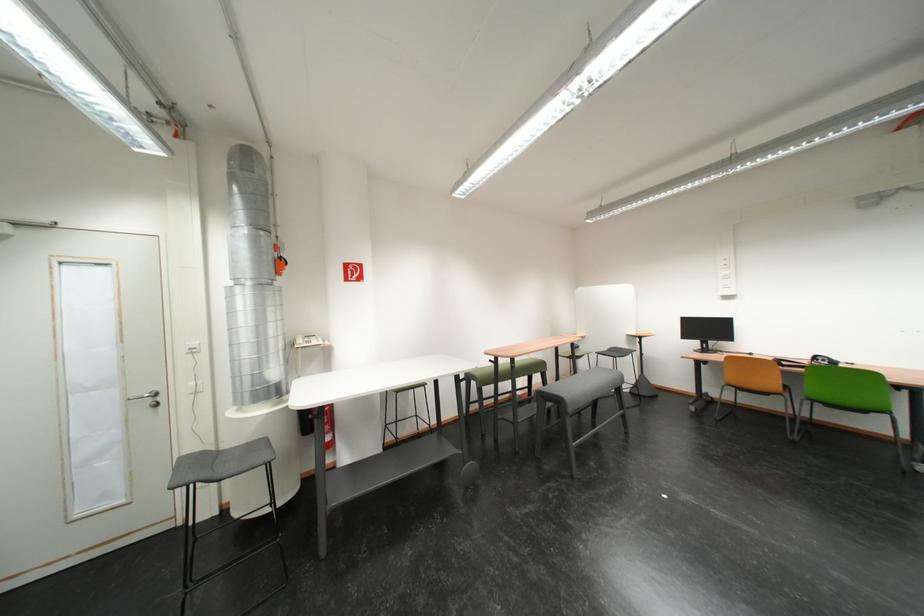
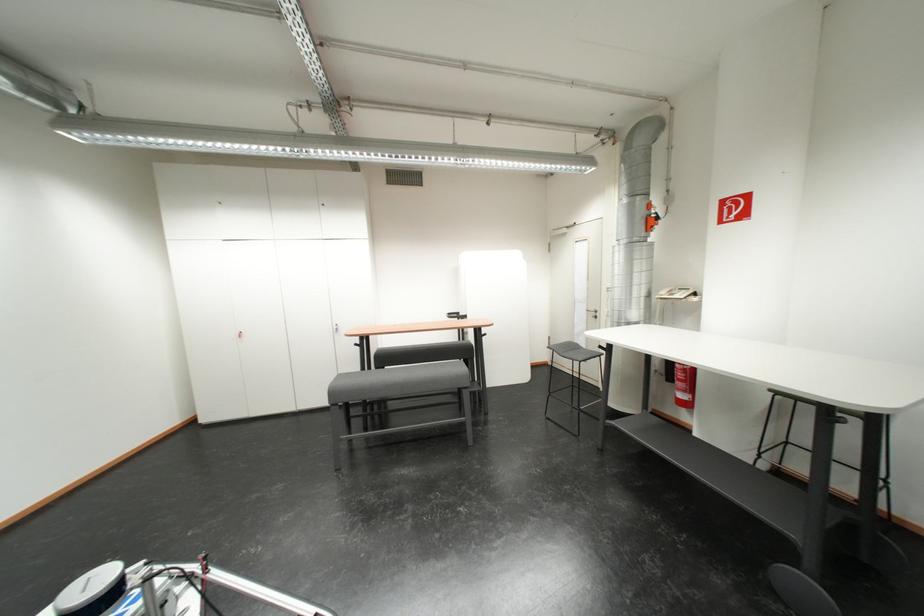
Locate, in the second image, the point that corresponds to the point at 284,265 in the first image.

(654, 224)